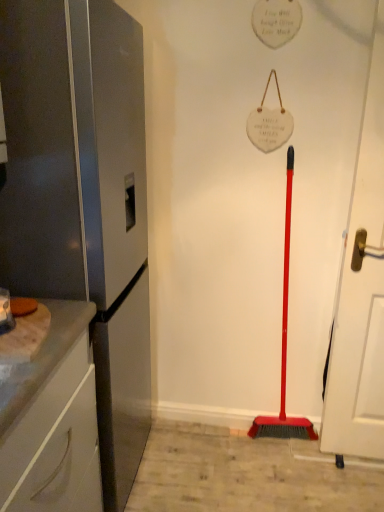
Find the location of a particular element. The height and width of the screenshot is (512, 384). vacant space to the left of white matte door at right is located at coordinates (307, 470).